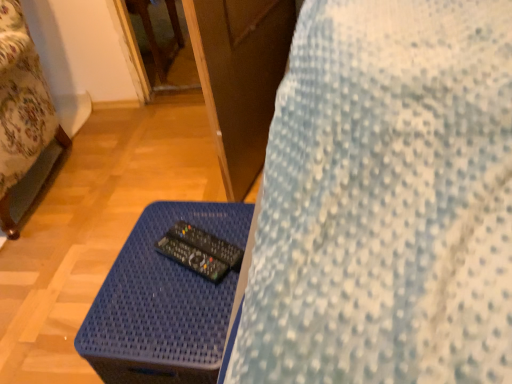
Locate an element on the screen. vacant space in front of black plastic remote at center, acting as the 2th control starting from the bottom is located at coordinates (174, 308).